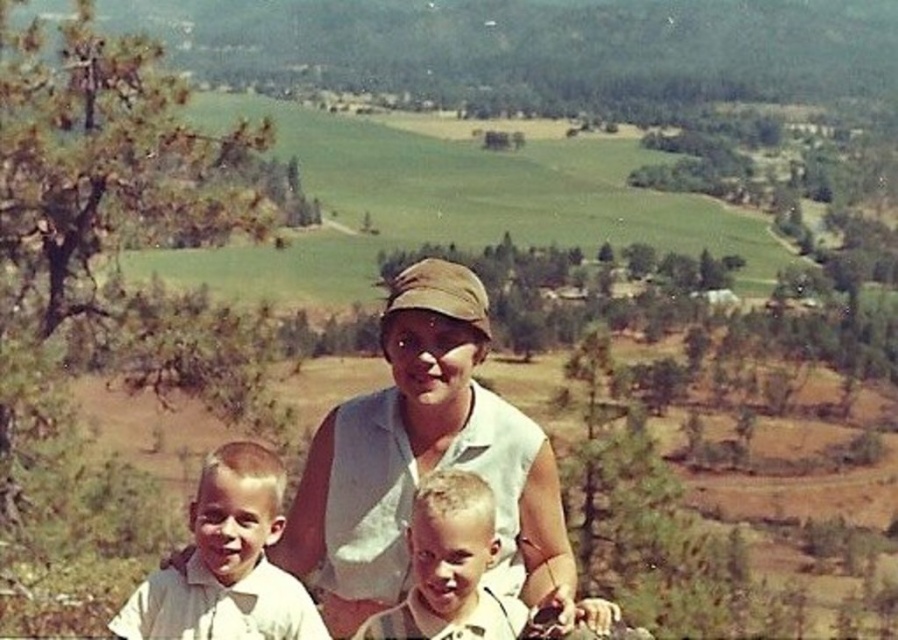
You are a photographer standing at the edge of the scene. You need to capture a closeup shot of both the white cotton shirt at center and the light brown hair at center in the same frame. Given their distance apart, will you be able to adjust your camera lens to include both subjects without moving your position?

The white cotton shirt at center is 86.17 centimeters away from the light brown hair at center. Since the distance between them is less than the typical focal length of a camera lens, you can adjust your lens to capture both subjects in the same frame without moving your position.

You are standing in the scenic outdoor setting and want to walk from the point at coordinates point (418, 477) to the point at coordinates point (474, 593). Which direction should you move relative to your current position?

You should move away from yourself because point (418, 477) is closer to you than point (474, 593). To reach point (474, 593), you need to move in the direction away from your current position towards the background of the scene.

You are standing at the point closer to the camera in the image. Which point are you at, point [456,376] or point [128,634]?

You are at point [128,634] because it is closer to the viewer than point [456,376].